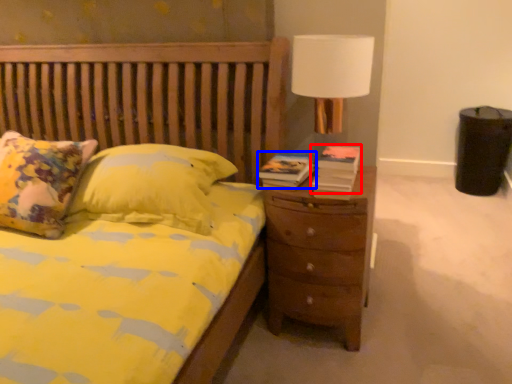
Question: Which point is further to the camera, book (highlighted by a red box) or book (highlighted by a blue box)?

Choices:
 (A) book
 (B) book

Answer: (B)